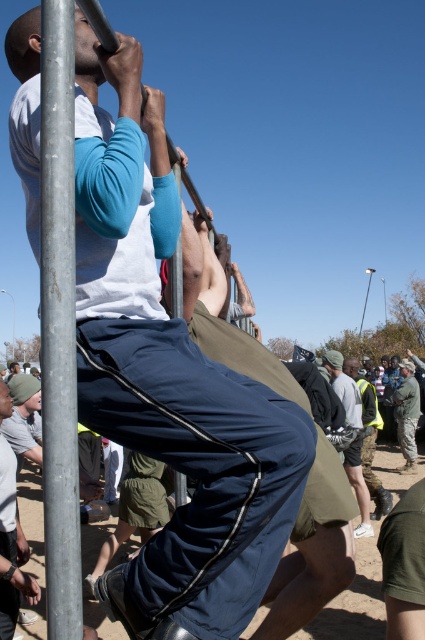
Between point (226, 515) and point (396, 400), which one is positioned behind?

The point (396, 400) is behind.

Based on the photo, measure the distance between matte blue track pants at center and camouflage fabric uniform at center.

10.52 meters

Image resolution: width=425 pixels, height=640 pixels. What are the coordinates of `matte blue track pants at center` in the screenshot? It's located at [170, 381].

Where is `matte blue track pants at center`? Image resolution: width=425 pixels, height=640 pixels. matte blue track pants at center is located at coordinates (170, 381).

Who is shorter, matte blue track pants at center or metallic pole at center?

metallic pole at center is shorter.

Locate an element on the screen. matte blue track pants at center is located at coordinates (170, 381).

I want to click on matte blue track pants at center, so click(x=170, y=381).

Can you confirm if metallic pole at center is positioned to the right of gray fabric shorts at center?

Incorrect, metallic pole at center is not on the right side of gray fabric shorts at center.

I want to click on metallic pole at center, so click(59, 323).